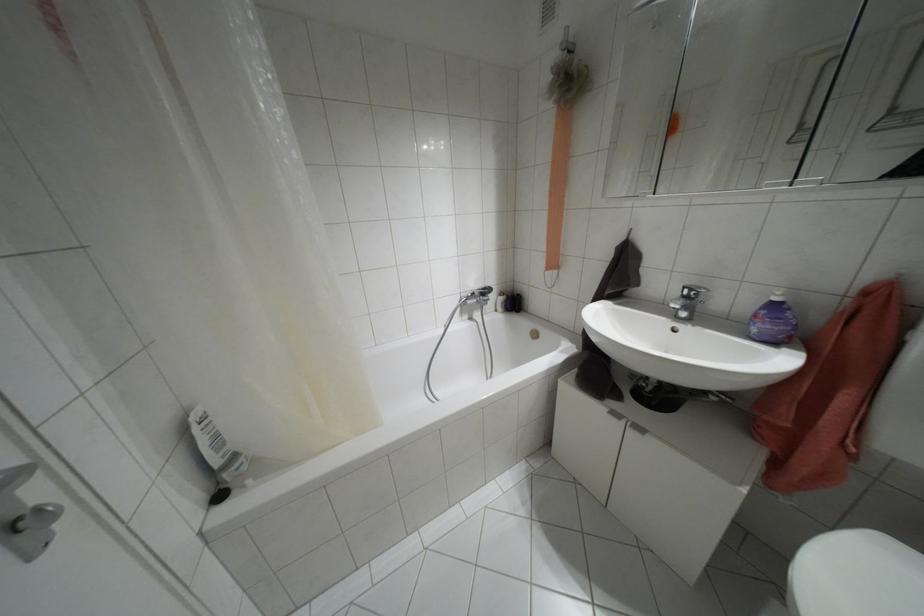
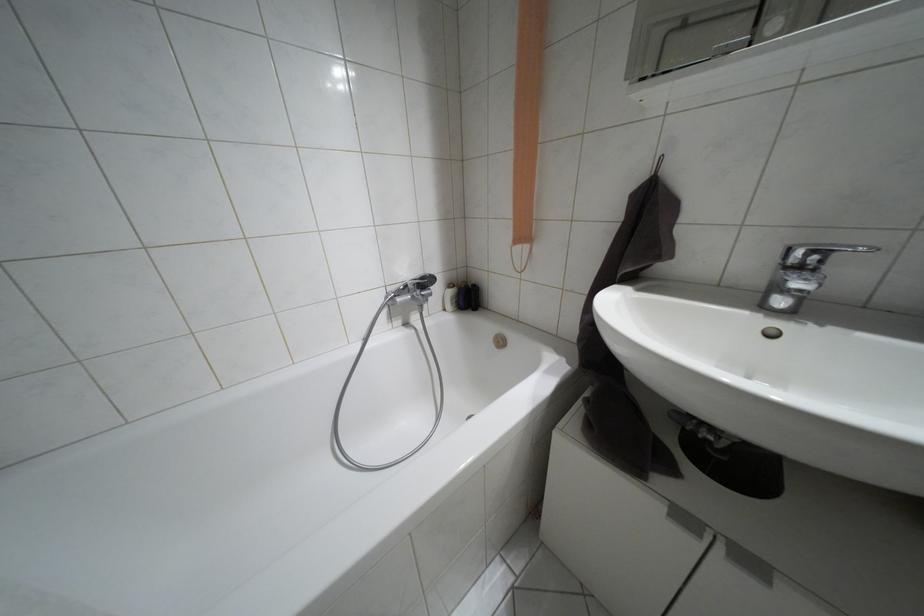
Where in the second image is the point corresponding to point (500, 293) from the first image?

(448, 285)